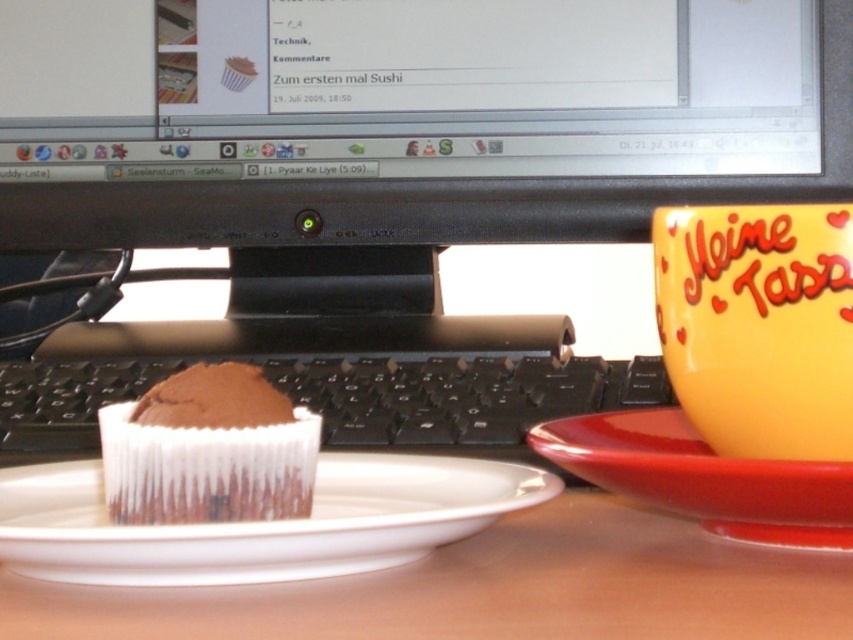
You are organizing your desk and want to move the black plastic keyboard at center closer to the computer monitor. The chocolate frosted cupcake at center is blocking the path. Which direction should you move the cupcake to clear the path?

The black plastic keyboard at center is to the left of the chocolate frosted cupcake at center. To clear the path, move the chocolate frosted cupcake to the right.